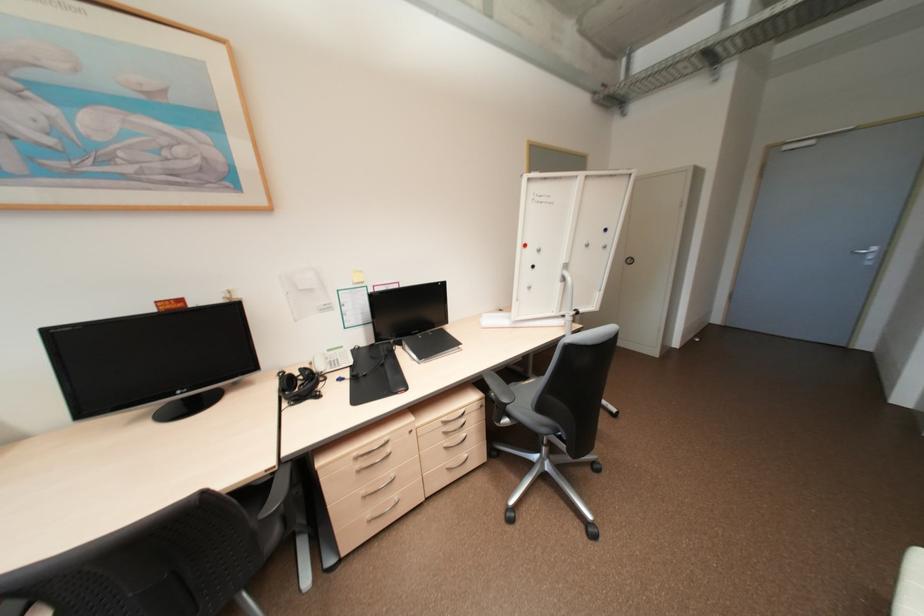
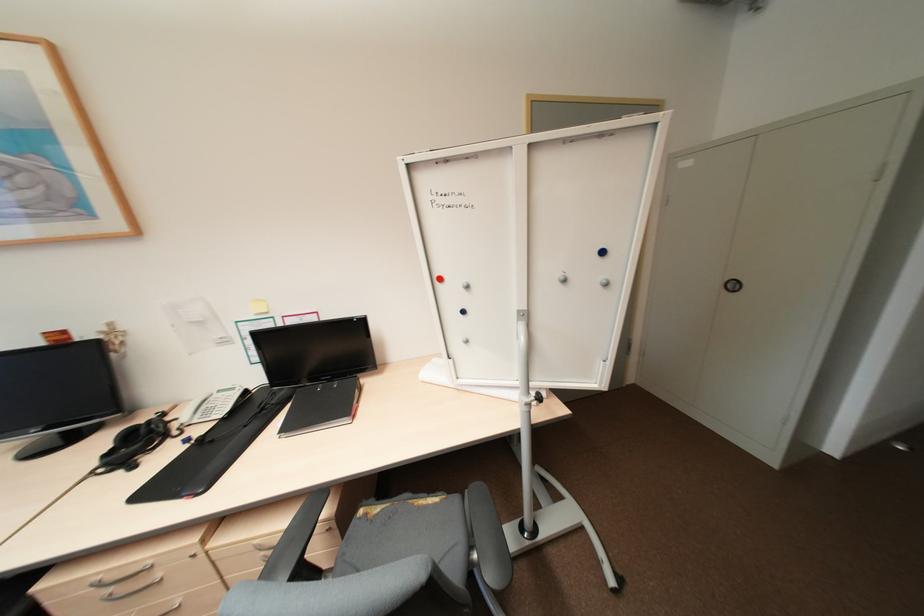
The point at (307, 386) is marked in the first image. Where is the corresponding point in the second image?

(142, 444)